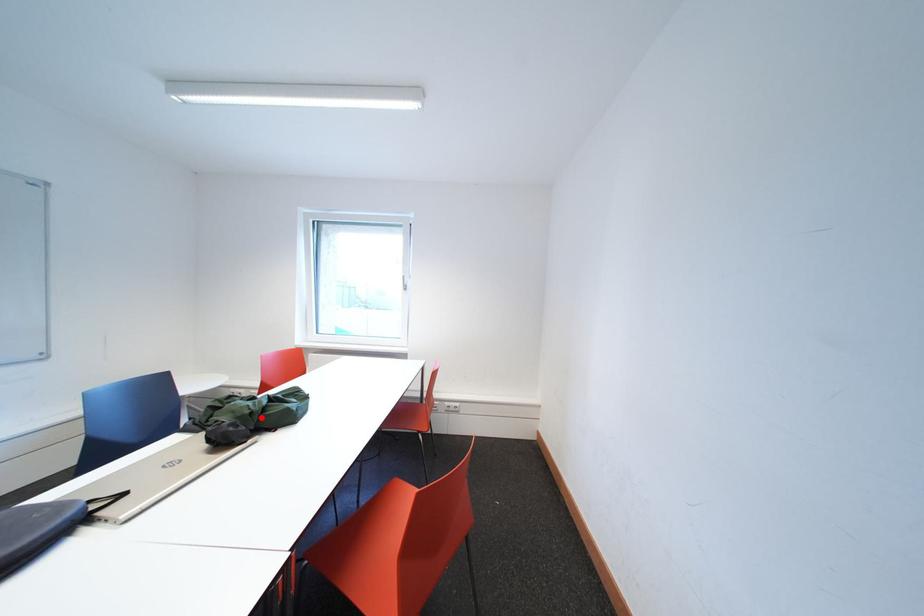
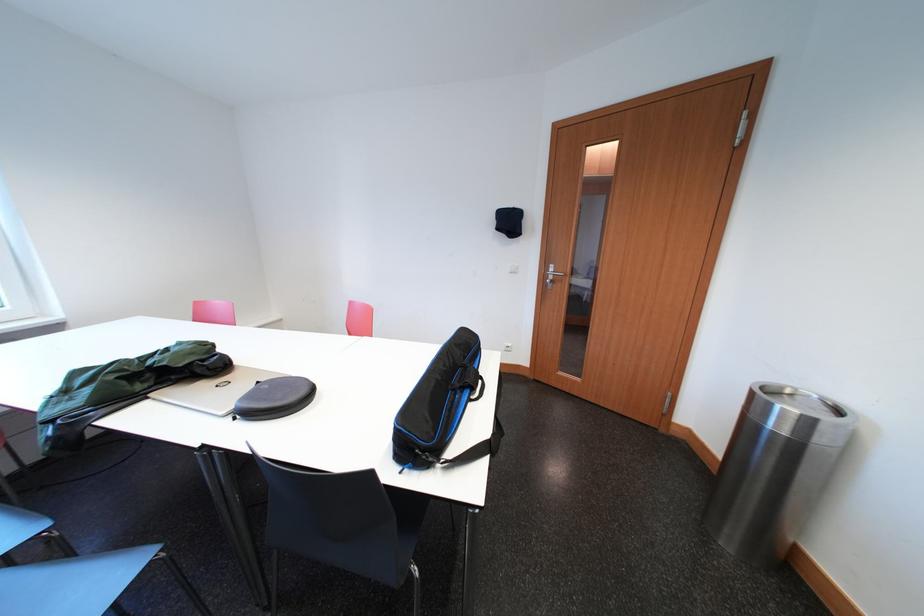
Find the pixel in the second image that matches the highlighted location in the first image.

(223, 350)